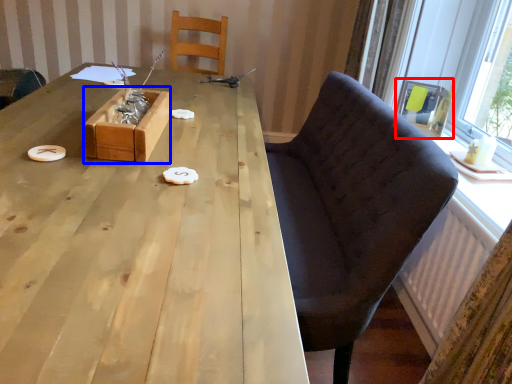
Question: Which point is closer to the camera, armchair (highlighted by a red box) or box (highlighted by a blue box)?

Choices:
 (A) armchair
 (B) box

Answer: (B)